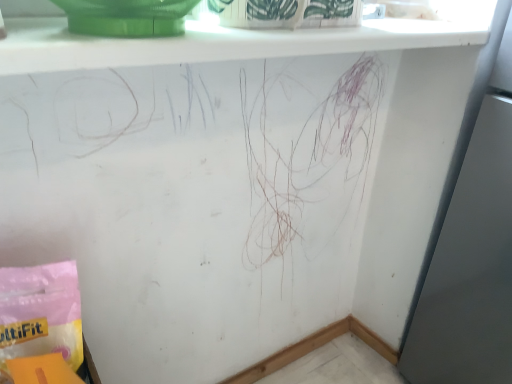
Question: From a real-world perspective, relative to white glossy window sill at upper center, is pink paper bag at lower left vertically above or below?

Choices:
 (A) above
 (B) below

Answer: (B)

Question: In terms of size, does pink paper bag at lower left appear bigger or smaller than white glossy window sill at upper center?

Choices:
 (A) big
 (B) small

Answer: (B)

Question: Do you think pink paper bag at lower left is within white glossy window sill at upper center, or outside of it?

Choices:
 (A) outside
 (B) inside

Answer: (A)

Question: In the image, is white glossy window sill at upper center on the left side or the right side of pink paper bag at lower left?

Choices:
 (A) right
 (B) left

Answer: (A)

Question: From the image's perspective, is white glossy window sill at upper center located above or below pink paper bag at lower left?

Choices:
 (A) above
 (B) below

Answer: (A)

Question: Is white glossy window sill at upper center spatially inside pink paper bag at lower left, or outside of it?

Choices:
 (A) inside
 (B) outside

Answer: (B)

Question: From a real-world perspective, is white glossy window sill at upper center above or below pink paper bag at lower left?

Choices:
 (A) below
 (B) above

Answer: (B)